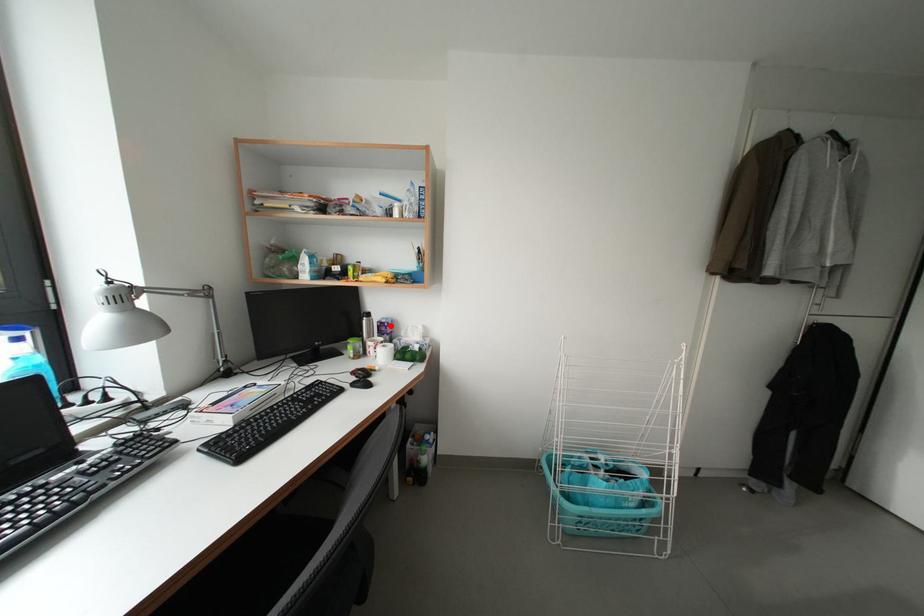
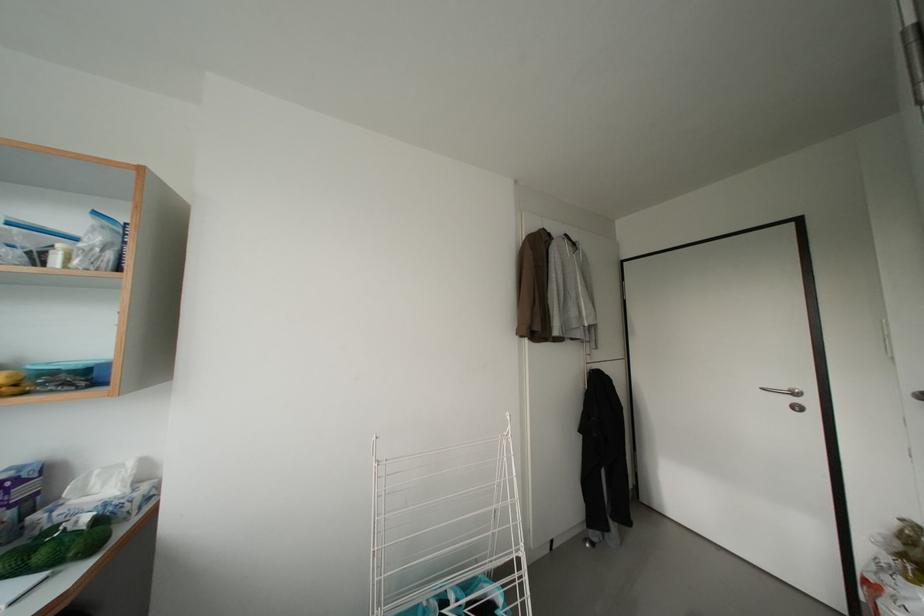
Question: A red point is marked in image1. In image2, is the corresponding 3D point closer to the camera or farther? Reply with the corresponding letter.

Choices:
 (A) The corresponding 3D point is closer.
 (B) The corresponding 3D point is farther.

Answer: (A)